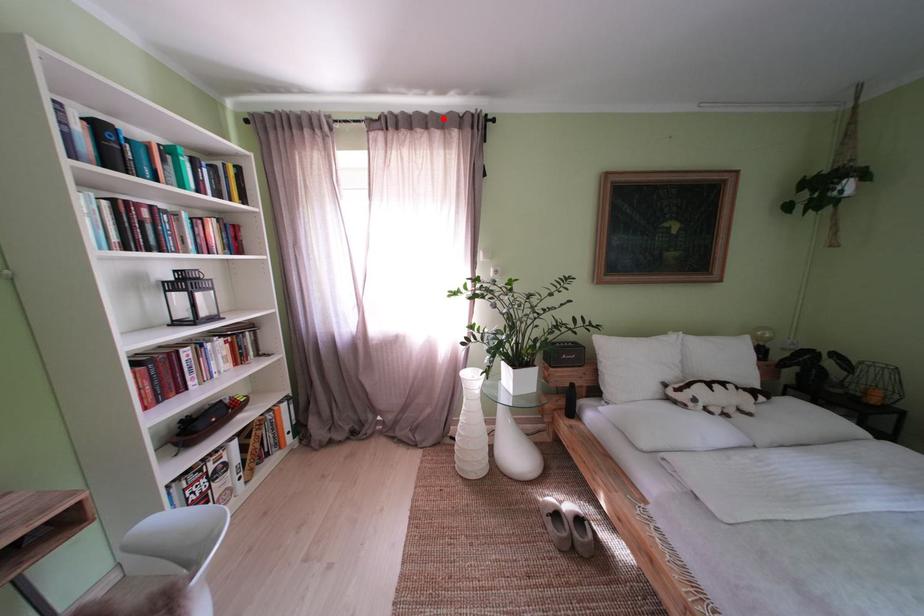
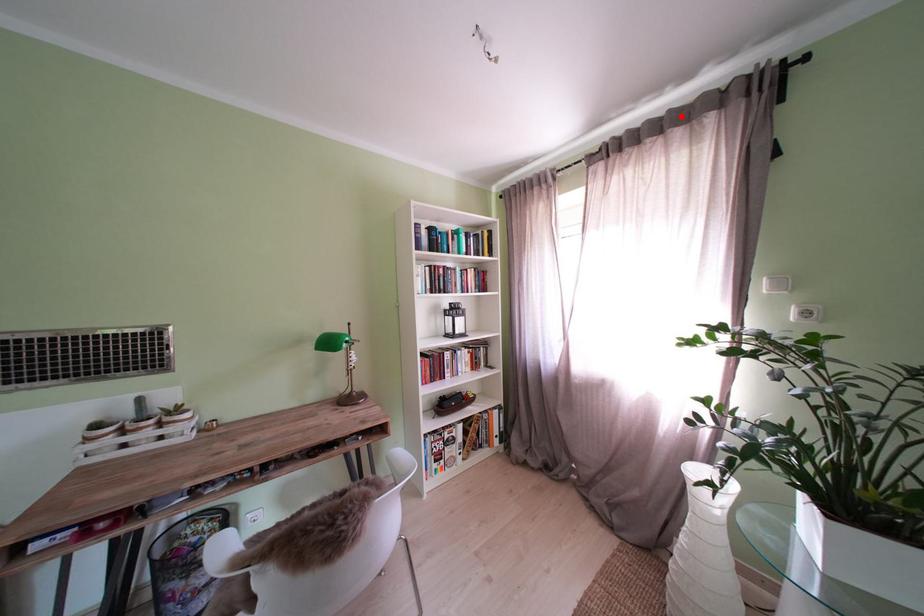
I am providing you with two images of the same scene from different viewpoints. A red point is marked on the first image and another point is marked on the second image. Is the marked point in image1 the same physical position as the marked point in image2?

Yes